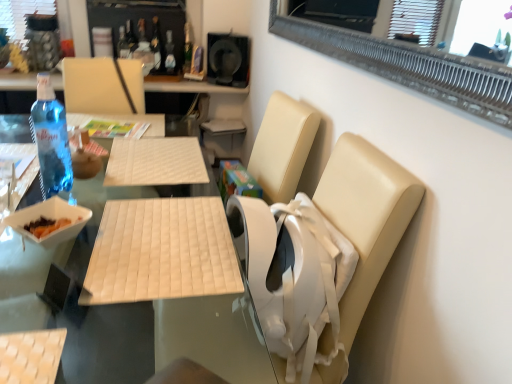
Question: Is blue glass bottle at left, the 1th bottle in the front-to-back sequence, a part of transparent plastic bottle at upper center, the second bottle in the bottom-to-top sequence?

Choices:
 (A) no
 (B) yes

Answer: (A)

Question: Is transparent plastic bottle at upper center, which is the third bottle in front-to-back order, at the left side of blue glass bottle at left, the 1th bottle in the front-to-back sequence?

Choices:
 (A) no
 (B) yes

Answer: (A)

Question: From a real-world perspective, is transparent plastic bottle at upper center, the second bottle in the bottom-to-top sequence, physically below blue glass bottle at left, the first bottle from the bottom?

Choices:
 (A) yes
 (B) no

Answer: (B)

Question: Is transparent plastic bottle at upper center, the second bottle in the bottom-to-top sequence, taller than blue glass bottle at left, the 1th bottle in the front-to-back sequence?

Choices:
 (A) yes
 (B) no

Answer: (B)

Question: Is transparent plastic bottle at upper center, acting as the 3th bottle starting from the top, aimed at blue glass bottle at left, arranged as the 4th bottle when viewed from the top?

Choices:
 (A) yes
 (B) no

Answer: (B)

Question: Relative to translucent glass bottle at upper center, which is the 4th bottle from front to back, is white quilted placemat at center, the second table from the top, in front or behind?

Choices:
 (A) behind
 (B) front

Answer: (B)

Question: From a real-world perspective, is white quilted placemat at center, the second table from the top, positioned above or below translucent glass bottle at upper center, marked as the 1th bottle in a back-to-front arrangement?

Choices:
 (A) below
 (B) above

Answer: (A)

Question: In the image, is white quilted placemat at center, acting as the first table starting from the bottom, on the left side or the right side of translucent glass bottle at upper center, which is the 4th bottle from front to back?

Choices:
 (A) right
 (B) left

Answer: (B)

Question: From their relative heights in the image, would you say white quilted placemat at center, acting as the first table starting from the bottom, is taller or shorter than translucent glass bottle at upper center, the fourth bottle in the bottom-to-top sequence?

Choices:
 (A) tall
 (B) short

Answer: (A)

Question: From the image's perspective, relative to white quilted mat at center, the second table in the bottom-to-top sequence, is beige woven fabric armchair at lower left above or below?

Choices:
 (A) above
 (B) below

Answer: (B)

Question: Considering the relative positions of beige woven fabric armchair at lower left and white quilted mat at center, the second table in the bottom-to-top sequence, in the image provided, is beige woven fabric armchair at lower left to the left or to the right of white quilted mat at center, the second table in the bottom-to-top sequence,?

Choices:
 (A) right
 (B) left

Answer: (B)

Question: Based on their sizes in the image, would you say beige woven fabric armchair at lower left is bigger or smaller than white quilted mat at center, the second table in the bottom-to-top sequence?

Choices:
 (A) big
 (B) small

Answer: (B)

Question: From a real-world perspective, is beige woven fabric armchair at lower left above or below white quilted mat at center, marked as the first table in a top-to-bottom arrangement?

Choices:
 (A) above
 (B) below

Answer: (A)

Question: Considering the positions of clear glass bottle at upper center, the third bottle in the back-to-front sequence, and blue glass bottle at left, the first bottle from the bottom, in the image, is clear glass bottle at upper center, the third bottle in the back-to-front sequence, wider or thinner than blue glass bottle at left, the first bottle from the bottom,?

Choices:
 (A) wide
 (B) thin

Answer: (A)

Question: Looking at the image, does clear glass bottle at upper center, the third bottle ordered from the bottom, seem bigger or smaller compared to blue glass bottle at left, positioned as the fourth bottle in back-to-front order?

Choices:
 (A) small
 (B) big

Answer: (A)